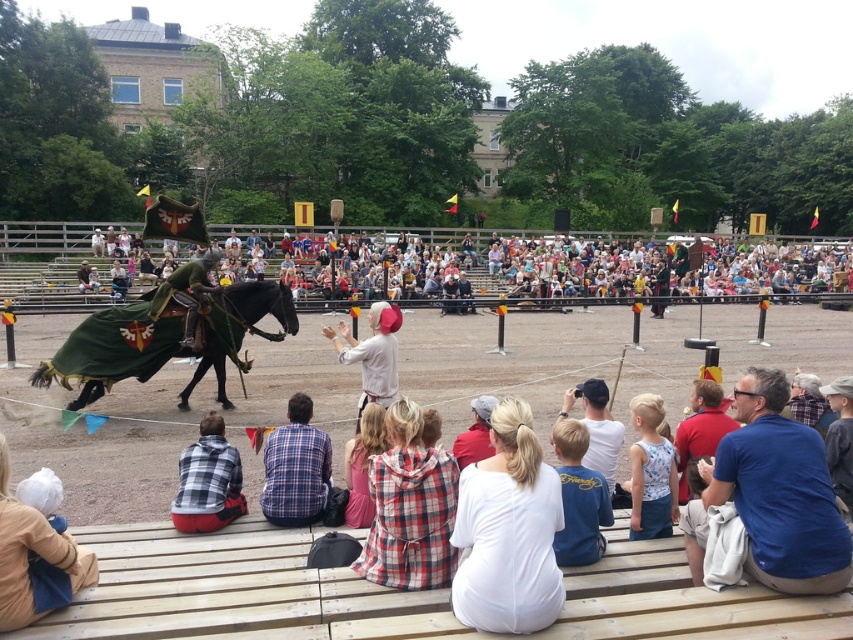
You are a photographer standing at the edge of the jousting arena. You want to capture a photo that includes both the plaid shirt at lower left and the white cotton hat at center. The minimum distance between these two objects in the frame must be at least 1.20 meters. Can you achieve this with your current positioning?

The plaid shirt at lower left and white cotton hat at center are 1.40 meters apart from each other, so yes, the photographer can achieve the required minimum distance of 1.20 meters between them in the photo.

You are standing at the point with coordinates (508, 531) in the image. What object are you standing on?

You are standing on the white cotton dress at center.

You are a photographer at the medieval event. You want to capture a photo of the plaid shirt at lower left and the white cotton hat at center. Which object is taller in the image?

The plaid shirt at lower left is taller than the white cotton hat at center.